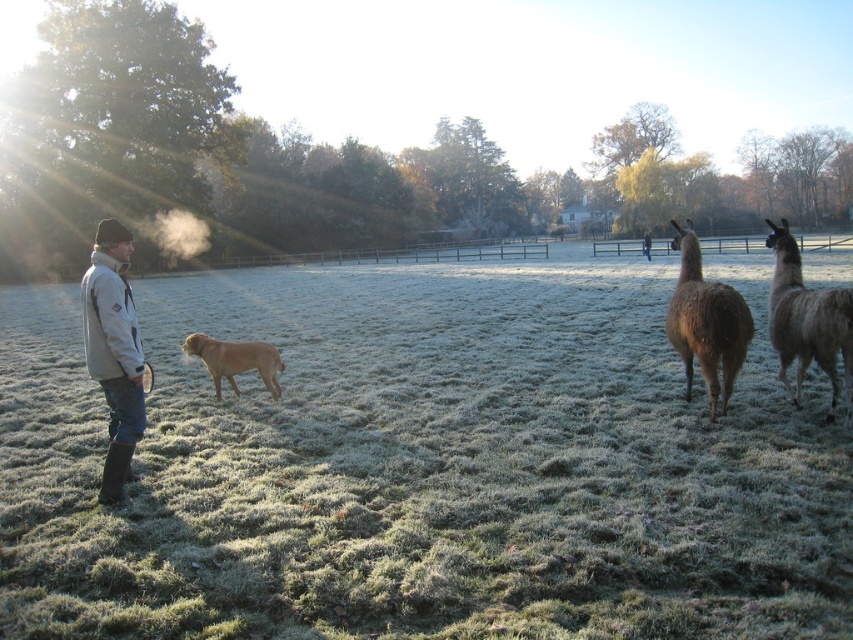
You are standing in the rural scene and want to walk from the frosted grass at lower left to the golden brown fur at center. Which direction should you head?

The frosted grass at lower left is positioned on the right side of golden brown fur at center, so you should head to the left to reach the golden brown fur at center from the frosted grass at lower left.

You are standing at the point labeled as point (x=850, y=352) in the image. You want to walk towards the point labeled as point (x=142, y=374). Which direction should you move relative to your current position?

You should move downward because point (x=142, y=374) is in front of point (x=850, y=352), indicating it is lower in the image.